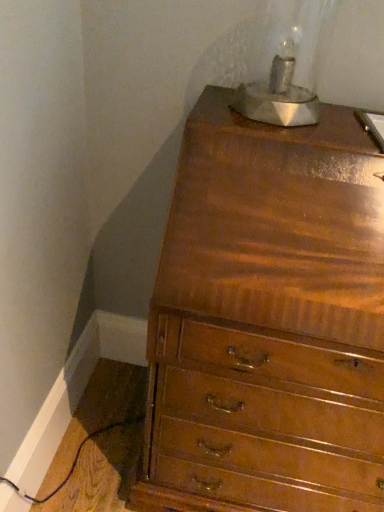
Find the location of a particular element. The image size is (384, 512). glossy wood chest of drawers at upper right is located at coordinates (268, 320).

This screenshot has height=512, width=384. Describe the element at coordinates (268, 320) in the screenshot. I see `glossy wood chest of drawers at upper right` at that location.

This screenshot has height=512, width=384. I want to click on glossy wood chest of drawers at upper right, so click(x=268, y=320).